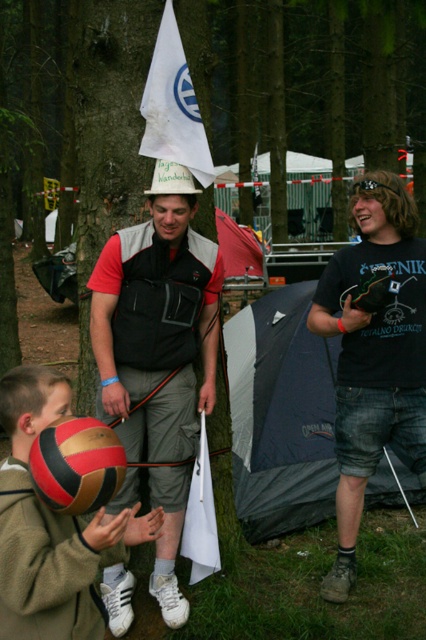
Is dark blue tarp at center to the right of red and gold textured volleyball at lower left from the viewer's perspective?

Indeed, dark blue tarp at center is positioned on the right side of red and gold textured volleyball at lower left.

Between dark blue tarp at center and red and gold textured volleyball at lower left, which one is positioned higher?

Positioned higher is red and gold textured volleyball at lower left.

Which is in front, point (244, 358) or point (94, 464)?

Positioned in front is point (94, 464).

Where is `dark blue tarp at center`? This screenshot has height=640, width=426. dark blue tarp at center is located at coordinates (281, 413).

Does point (135, 428) lie in front of point (267, 300)?

Yes, it is in front of point (267, 300).

Can you confirm if matte black vest at center is positioned to the left of dark blue tarp at center?

Yes, matte black vest at center is to the left of dark blue tarp at center.

Locate an element on the screen. Image resolution: width=426 pixels, height=640 pixels. matte black vest at center is located at coordinates (157, 321).

You are a GUI agent. You are given a task and a screenshot of the screen. Output one action in this format:
    pyautogui.click(x=<x>, y=<y>)
    Task: Click on the matte black vest at center
    The height and width of the screenshot is (640, 426).
    Given the screenshot: What is the action you would take?
    pyautogui.click(x=157, y=321)

Who is more distant from viewer, (x=316, y=340) or (x=31, y=570)?

Point (x=316, y=340)

Is dark blue tarp at center to the left of brown leather ball at lower left from the viewer's perspective?

Incorrect, dark blue tarp at center is not on the left side of brown leather ball at lower left.

Is point (244, 477) behind point (94, 582)?

That is True.

The width and height of the screenshot is (426, 640). Identify the location of dark blue tarp at center. (281, 413).